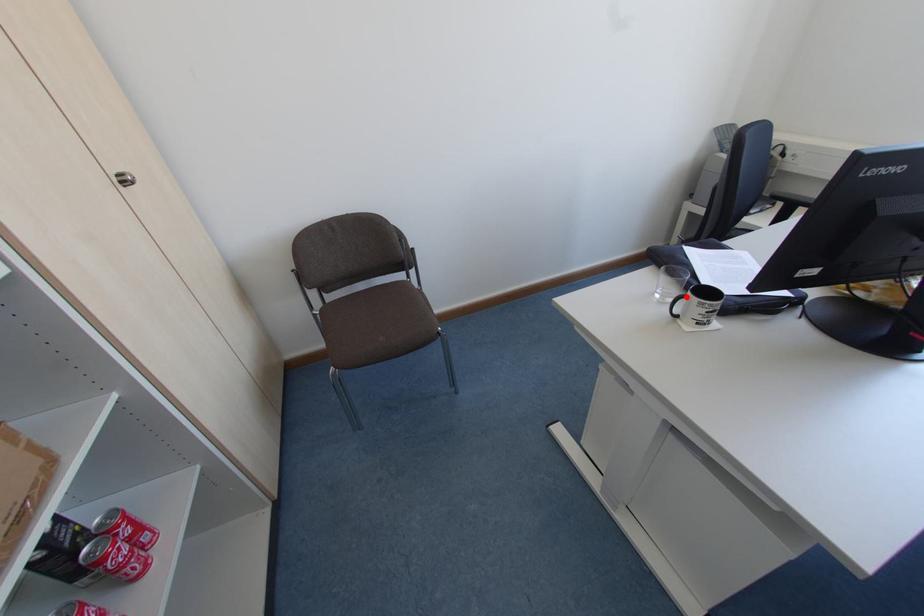
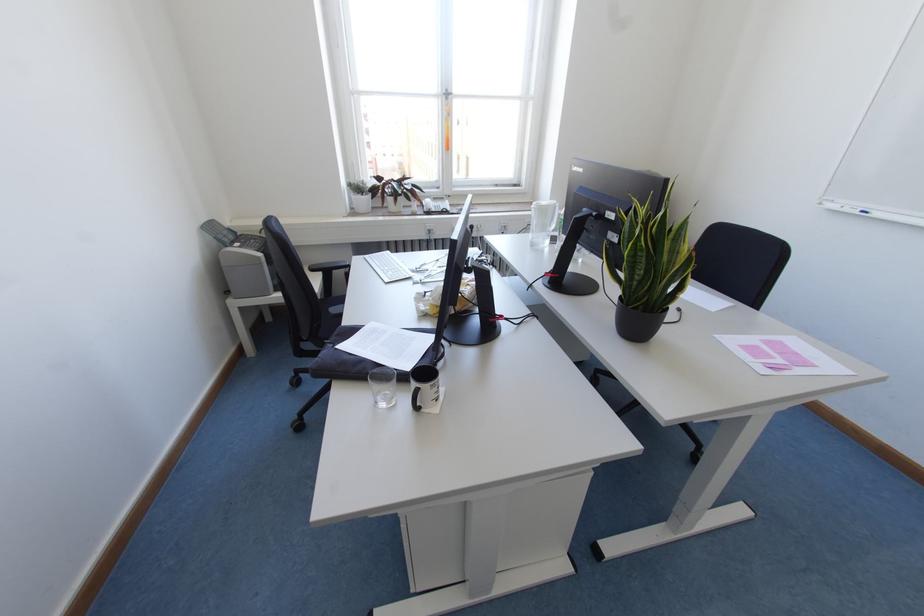
Locate, in the second image, the point that corresponds to the highlighted location in the first image.

(419, 387)